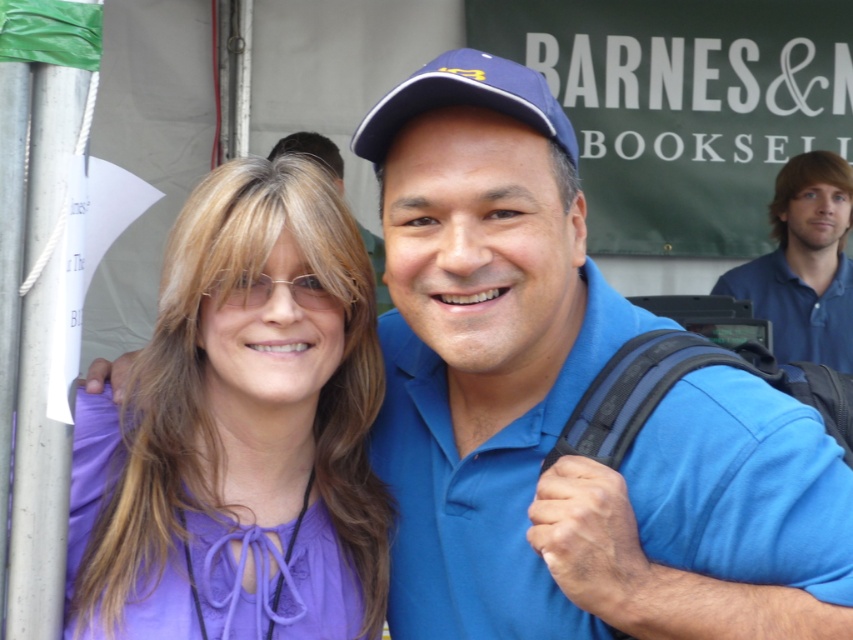
Who is more forward, (776, 188) or (532, 124)?

Point (532, 124) is in front.

At what (x,y) coordinates should I click in order to perform the action: click on blue cotton shirt at upper right. Please return your answer as a coordinate pair (x, y). The width and height of the screenshot is (853, 640). Looking at the image, I should click on (804, 262).

Between point (296, 429) and point (828, 173), which one is positioned behind?

The point (828, 173) is behind.

Does purple silky blouse at center have a lesser height compared to blue cotton shirt at upper right?

Correct, purple silky blouse at center is not as tall as blue cotton shirt at upper right.

This screenshot has width=853, height=640. I want to click on purple silky blouse at center, so click(x=241, y=432).

Is point (846, 104) closer to viewer compared to point (758, 292)?

No, it is not.

Between green fabric sign at upper center and blue cotton shirt at upper right, which one has more height?

Standing taller between the two is green fabric sign at upper center.

Which is in front, point (643, 90) or point (770, 211)?

Point (770, 211) is in front.

Image resolution: width=853 pixels, height=640 pixels. In order to click on green fabric sign at upper center in this screenshot , I will do `click(683, 106)`.